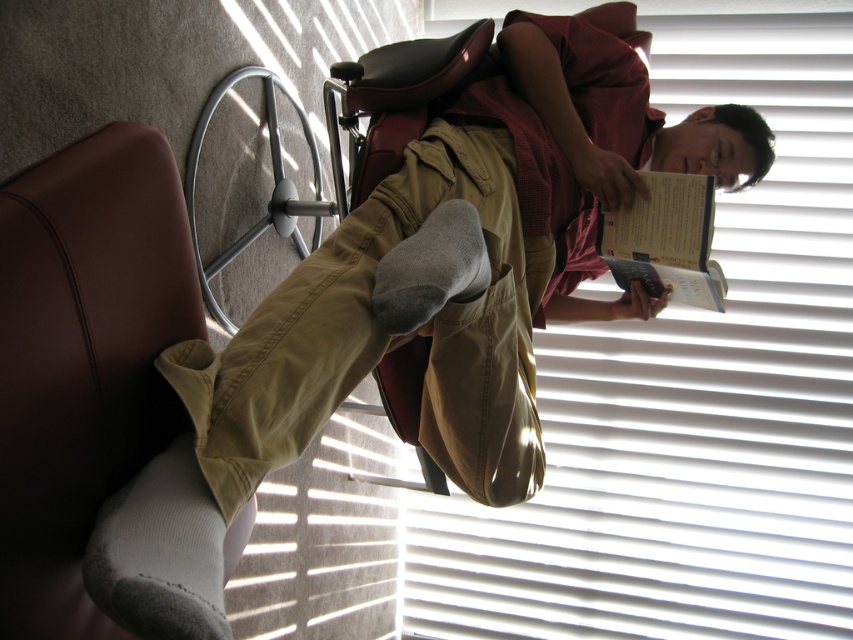
Question: Considering the real-world distances, which object is farthest from the khaki cotton pants at center?

Choices:
 (A) hardcover book at right
 (B) gray fleece sock at center

Answer: (A)

Question: Estimate the real-world distances between objects in this image. Which object is farther from the hardcover book at right?

Choices:
 (A) gray fleece sock at center
 (B) khaki cotton pants at center

Answer: (A)

Question: Is khaki cotton pants at center closer to camera compared to hardcover book at right?

Choices:
 (A) yes
 (B) no

Answer: (A)

Question: Is hardcover book at right above gray fleece sock at center?

Choices:
 (A) yes
 (B) no

Answer: (A)

Question: Which object appears farthest from the camera in this image?

Choices:
 (A) gray fleece sock at center
 (B) khaki cotton pants at center

Answer: (A)

Question: Is the position of khaki cotton pants at center more distant than that of gray fleece sock at center?

Choices:
 (A) no
 (B) yes

Answer: (A)